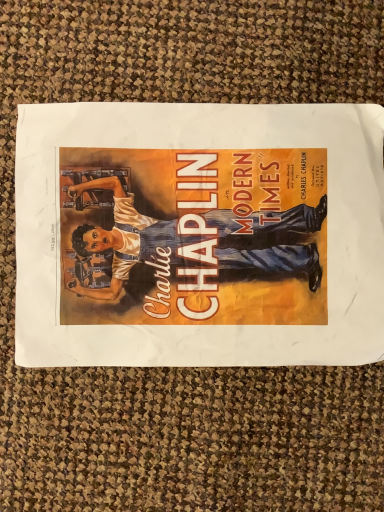
Describe the element at coordinates (199, 234) in the screenshot. I see `matte paper poster at center` at that location.

What are the coordinates of `matte paper poster at center` in the screenshot? It's located at (199, 234).

What is the approximate height of matte paper poster at center?

0.82 inches.

This screenshot has height=512, width=384. In order to click on matte paper poster at center in this screenshot , I will do `click(199, 234)`.